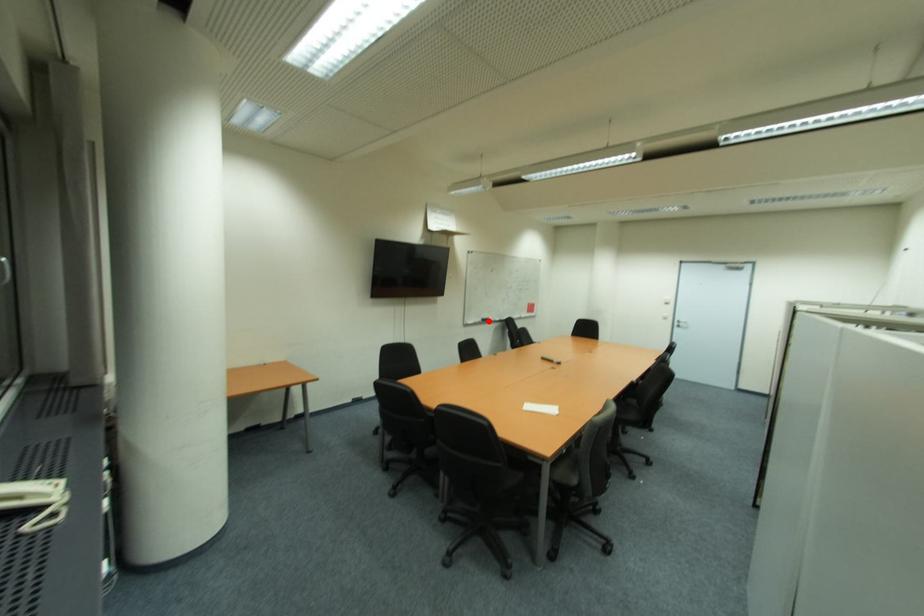
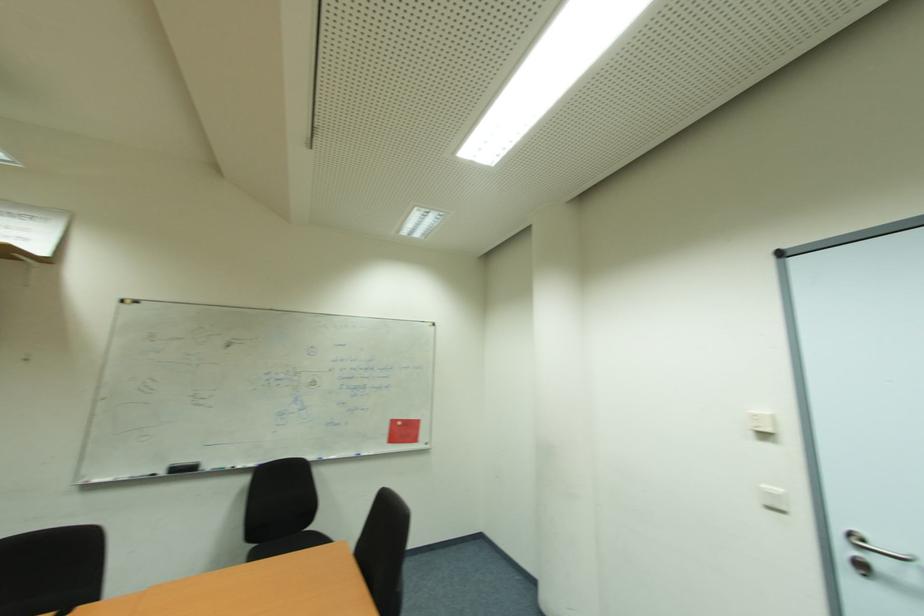
Find the pixel in the second image that matches the highlighted location in the first image.

(189, 469)